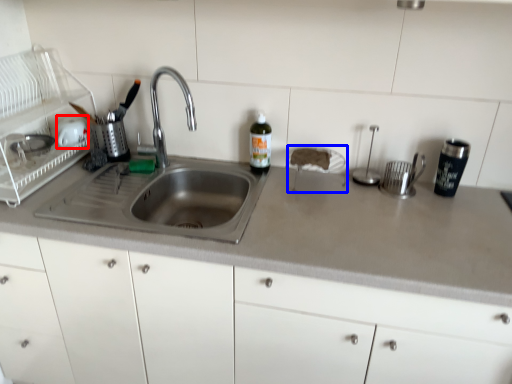
Question: Which object appears closest to the camera in this image, appliance (highlighted by a red box) or appliance (highlighted by a blue box)?

Choices:
 (A) appliance
 (B) appliance

Answer: (B)